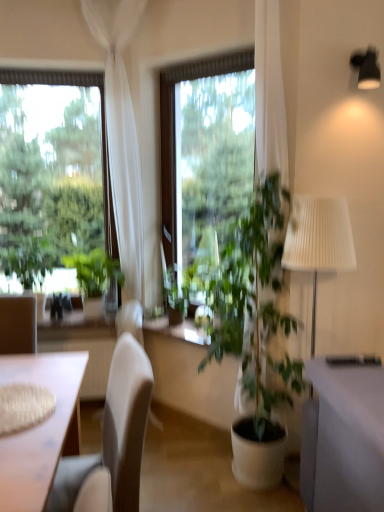
Question: Looking at their shapes, would you say green leafy plant at left, placed as the second houseplant when sorted from right to left, is wider or thinner than green leafy plant at center, the second houseplant positioned from the left?

Choices:
 (A) wide
 (B) thin

Answer: (A)

Question: Is green leafy plant at left, placed as the second houseplant when sorted from right to left, bigger or smaller than green leafy plant at center, the second houseplant positioned from the left?

Choices:
 (A) big
 (B) small

Answer: (A)

Question: Estimate the real-world distances between objects in this image. Which object is closer to the white fabric chair at left?

Choices:
 (A) transparent glass window at left, the 1th window when ordered from left to right
 (B) green leafy plant at left, placed as the second houseplant when sorted from right to left
 (C) transparent glass window at center, the 1th window in the right-to-left sequence
 (D) green leafy plant at left
 (E) white sheer curtain at left

Answer: (B)

Question: Based on their relative distances, which object is farther from the green leafy plant at left?

Choices:
 (A) transparent glass window at center, the 1th window in the right-to-left sequence
 (B) transparent glass window at left, the 1th window when ordered from left to right
 (C) white sheer curtain at left
 (D) green leafy plant at center, the second houseplant positioned from the left
 (E) green leafy plant at left, placed as the second houseplant when sorted from right to left

Answer: (A)